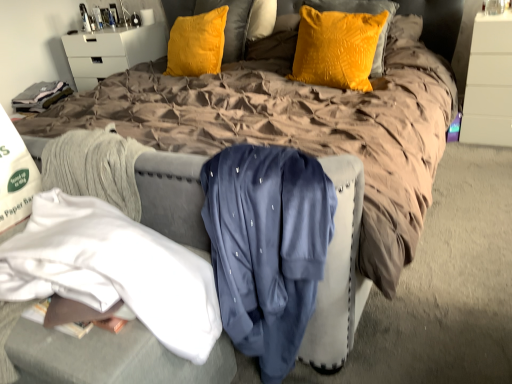
Question: Would you say white glossy nightstand at upper left is to the left or to the right of white fabric at lower left, which ranks as the 1th clothing in left-to-right order, in the picture?

Choices:
 (A) left
 (B) right

Answer: (A)

Question: Is white glossy nightstand at upper left spatially inside white fabric at lower left, which ranks as the 1th clothing in left-to-right order, or outside of it?

Choices:
 (A) inside
 (B) outside

Answer: (B)

Question: Which object is the farthest from the velvet yellow pillow at center, the first pillow viewed from the left?

Choices:
 (A) white fabric at lower left, the 2th clothing positioned from the right
 (B) brown quilted bed at center
 (C) white glossy nightstand at upper left
 (D) velvet yellow pillow at upper center, the second pillow viewed from the left
 (E) navy blue satin shirt at center, which is the 2th clothing from left to right

Answer: (E)

Question: Considering the real-world distances, which object is closest to the brown quilted bed at center?

Choices:
 (A) velvet yellow pillow at center, the first pillow viewed from the left
 (B) velvet yellow pillow at upper center, the second pillow viewed from the left
 (C) white fabric at lower left, which ranks as the 1th clothing in left-to-right order
 (D) white glossy dresser at upper right
 (E) white glossy nightstand at upper left

Answer: (B)